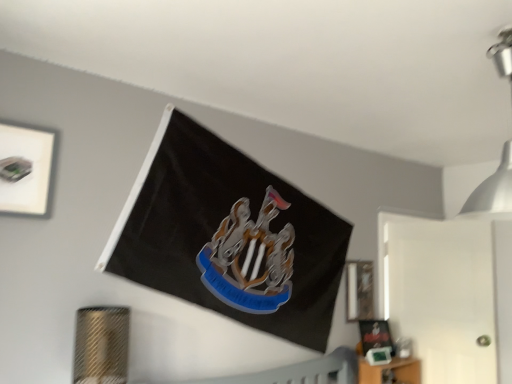
Question: From a real-world perspective, relative to matte black picture frame at lower right, which is the 2th picture frame from front to back, is matte black picture frame at right, acting as the 2th picture frame starting from the left, vertically above or below?

Choices:
 (A) above
 (B) below

Answer: (A)

Question: From their relative heights in the image, would you say matte black picture frame at right, which is the 2th picture frame in top-to-bottom order, is taller or shorter than matte black picture frame at lower right, which is the 1th picture frame in right-to-left order?

Choices:
 (A) short
 (B) tall

Answer: (B)

Question: Which object is the farthest from the matte black picture frame at right, acting as the 2th picture frame starting from the left?

Choices:
 (A) matte black picture frame at lower right, the third picture frame from the top
 (B) white matte picture frame at upper left, which is the first picture frame from front to back
 (C) metallic silver light fixture at upper right

Answer: (B)

Question: Which of these objects is positioned farthest from the matte black picture frame at lower right, which is the 1th picture frame in right-to-left order?

Choices:
 (A) metallic silver light fixture at upper right
 (B) matte black picture frame at right, positioned as the 2th picture frame in right-to-left order
 (C) white matte picture frame at upper left, which is the first picture frame from front to back

Answer: (C)